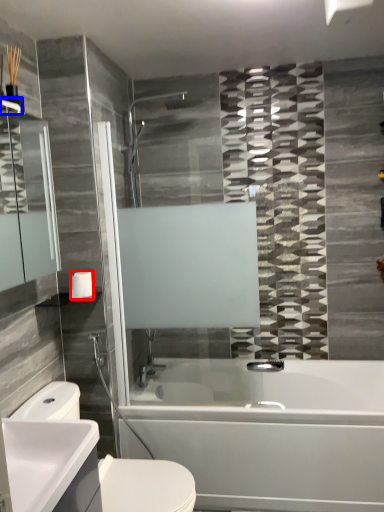
Question: Among these objects, which one is farthest to the camera, toilet paper (highlighted by a red box) or towel bar (highlighted by a blue box)?

Choices:
 (A) toilet paper
 (B) towel bar

Answer: (A)